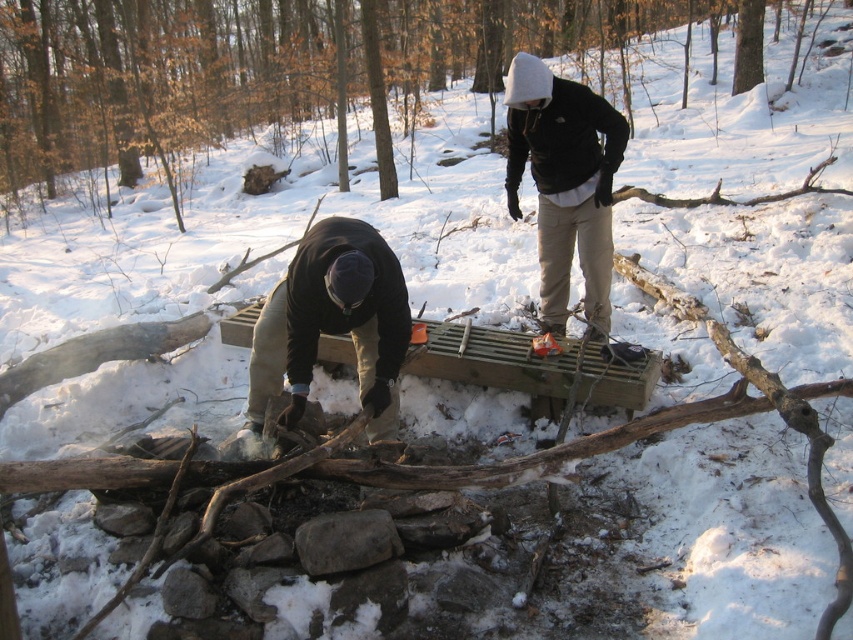
You are standing in the snowy forest and need to place a small flag exactly halfway between point (x=697, y=10) and point (x=386, y=266). Will the flag be closer to the person on the left or the person on the right?

The flag placed halfway between point (x=697, y=10) and point (x=386, y=266) will be closer to the person on the right because point (x=697, y=10) is further away from the viewer compared to point (x=386, y=266). Since the flag is halfway, its position depends on the depth of the points. Since point (x=697, y=10) is closer to the viewer, the midpoint in depth would still be closer to the viewer, but the question is about proximity to the people. Wait, perhaps I need to clarify based on the spatial description. The

You are trying to place the brown woolen sweater at lower left on top of the smooth brown log at center. Is this possible based on their current positions?

The smooth brown log at center is currently above the brown woolen sweater at lower left, so placing the sweater on top would require moving the log first.

In the scene shown: You are standing at the point labeled as point (252, 58) in this snowy forest scene. You want to take a photo of the entire area using a camera that has a maximum range of 20 meters. Will you be able to capture the entire scene in one shot?

The point labeled point (252, 58) is 23.25 meters away from the camera. Since the camera has a maximum range of 20 meters, you will not be able to capture the entire scene in one shot because the distance exceeds the camera range.